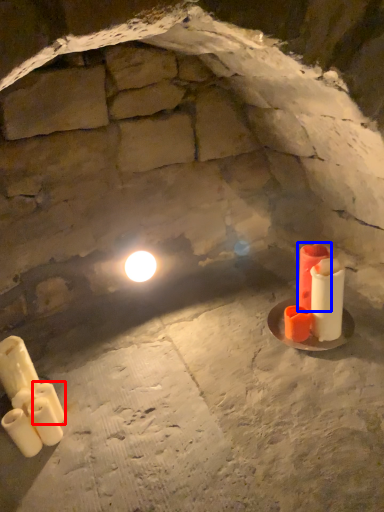
Question: Which object is closer to the camera taking this photo, candle (highlighted by a red box) or candle (highlighted by a blue box)?

Choices:
 (A) candle
 (B) candle

Answer: (A)